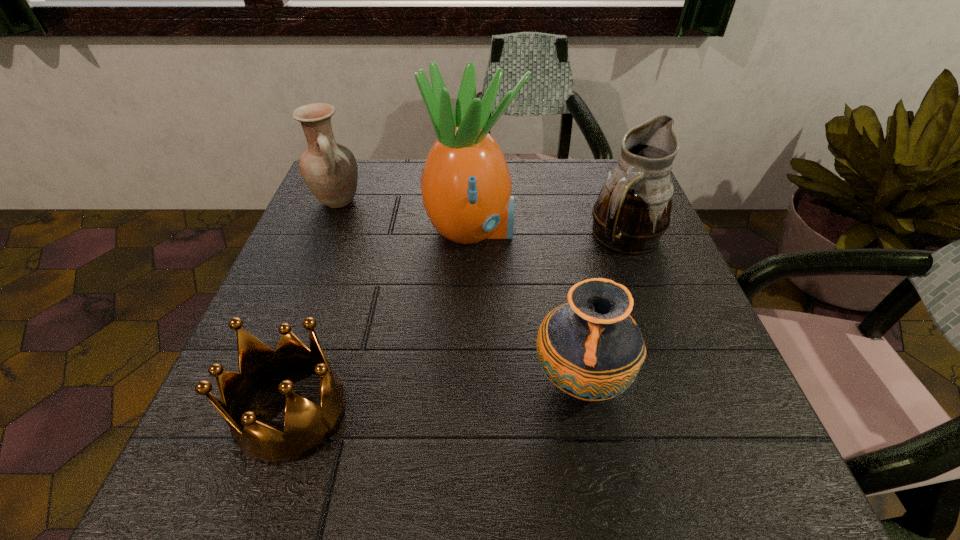
The height and width of the screenshot is (540, 960). I want to click on unoccupied area between the farther pottery and the shortest object, so click(315, 307).

At what (x,y) coordinates should I click in order to perform the action: click on vacant area between the shorter pottery and the farther pottery. Please return your answer as a coordinate pair (x, y). Looking at the image, I should click on (459, 291).

Identify which object is located as the second nearest to the shorter pottery. Please provide its 2D coordinates. Your answer should be formatted as a tuple, i.e. [(x, y)], where the tuple contains the x and y coordinates of a point satisfying the conditions above.

[(466, 186)]

Locate which object ranks fourth in proximity to the crown. Please provide its 2D coordinates. Your answer should be formatted as a tuple, i.e. [(x, y)], where the tuple contains the x and y coordinates of a point satisfying the conditions above.

[(632, 212)]

Where is `vacant area in the image that satisfies the following two spatial constraints: 1. on the front side of the farther pottery; 2. on the right side of the nearer pottery`? This screenshot has width=960, height=540. vacant area in the image that satisfies the following two spatial constraints: 1. on the front side of the farther pottery; 2. on the right side of the nearer pottery is located at coordinates (265, 381).

Find the location of a particular element. free location that satisfies the following two spatial constraints: 1. at the entrance of the tallest object; 2. on the front side of the shortest object is located at coordinates (468, 412).

This screenshot has width=960, height=540. In order to click on vacant region that satisfies the following two spatial constraints: 1. at the entrance of the tallest object; 2. on the left side of the right pottery in this screenshot , I will do `click(469, 381)`.

This screenshot has width=960, height=540. I want to click on vacant space that satisfies the following two spatial constraints: 1. at the entrance of the second shortest object; 2. on the left side of the tallest object, so click(x=469, y=381).